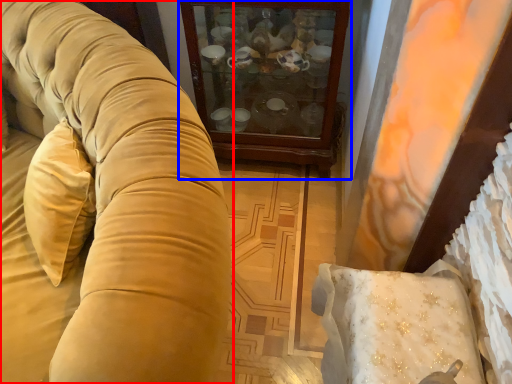
Question: Which point is closer to the camera, studio couch (highlighted by a red box) or furniture (highlighted by a blue box)?

Choices:
 (A) studio couch
 (B) furniture

Answer: (A)